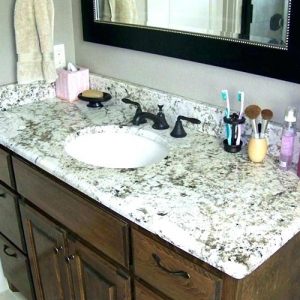
The height and width of the screenshot is (300, 300). Identify the location of faucet. (151, 115).